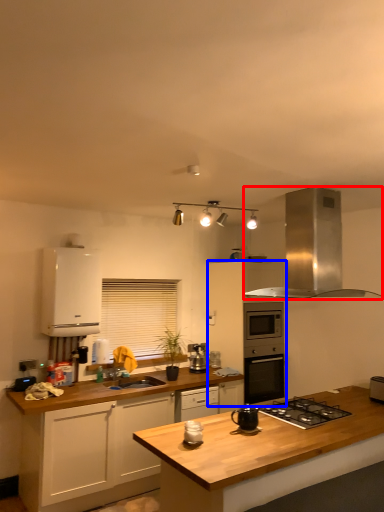
Question: Which object appears closest to the camera in this image, home appliance (highlighted by a red box) or cabinetry (highlighted by a blue box)?

Choices:
 (A) home appliance
 (B) cabinetry

Answer: (A)